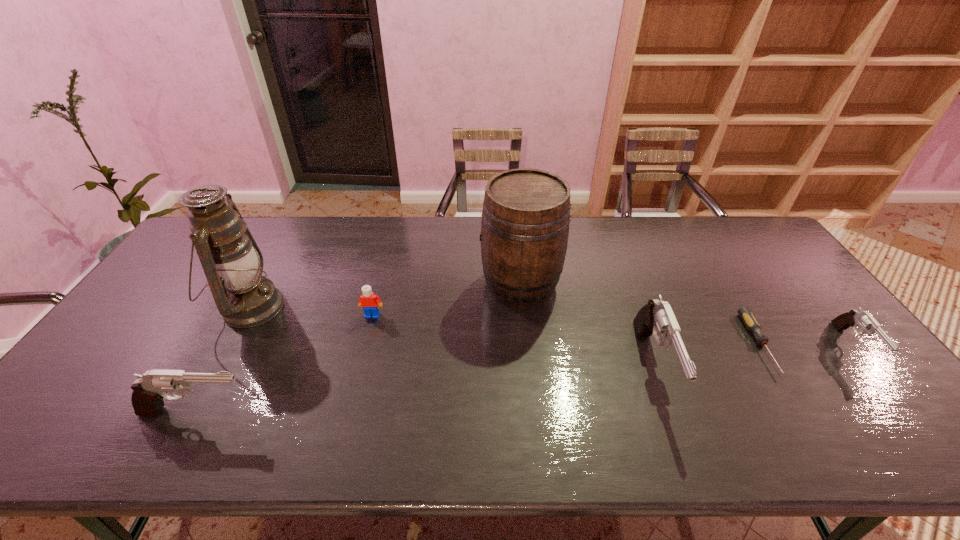
The width and height of the screenshot is (960, 540). What are the coordinates of `the second shortest gun` in the screenshot? It's located at (149, 390).

This screenshot has height=540, width=960. What are the coordinates of `the fourth shortest object` in the screenshot? It's located at (149, 390).

Identify the location of the second gun from left to right. (657, 316).

The height and width of the screenshot is (540, 960). Find the location of `the rightmost object`. the rightmost object is located at coordinates (854, 318).

Find the location of a particular element. Image resolution: width=960 pixels, height=540 pixels. the shortest gun is located at coordinates (854, 318).

Identify the location of oil lamp. [x=232, y=262].

You are a GUI agent. You are given a task and a screenshot of the screen. Output one action in this format:
    pyautogui.click(x=<x>, y=<y>)
    Task: Click on the second tallest object
    This screenshot has height=540, width=960.
    Given the screenshot: What is the action you would take?
    pyautogui.click(x=525, y=222)

Identify the location of the fourth object from right to left. (525, 222).

The height and width of the screenshot is (540, 960). I want to click on the second object from right to left, so click(745, 313).

This screenshot has height=540, width=960. Find the location of `screwdriver`. screwdriver is located at coordinates (745, 313).